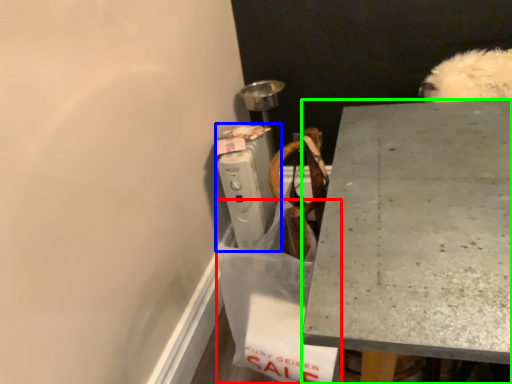
Question: Based on their relative distances, which object is farther from shopping bag (highlighted by a red box)? Choose from radiator (highlighted by a blue box) and desk (highlighted by a green box).

Choices:
 (A) radiator
 (B) desk

Answer: (A)